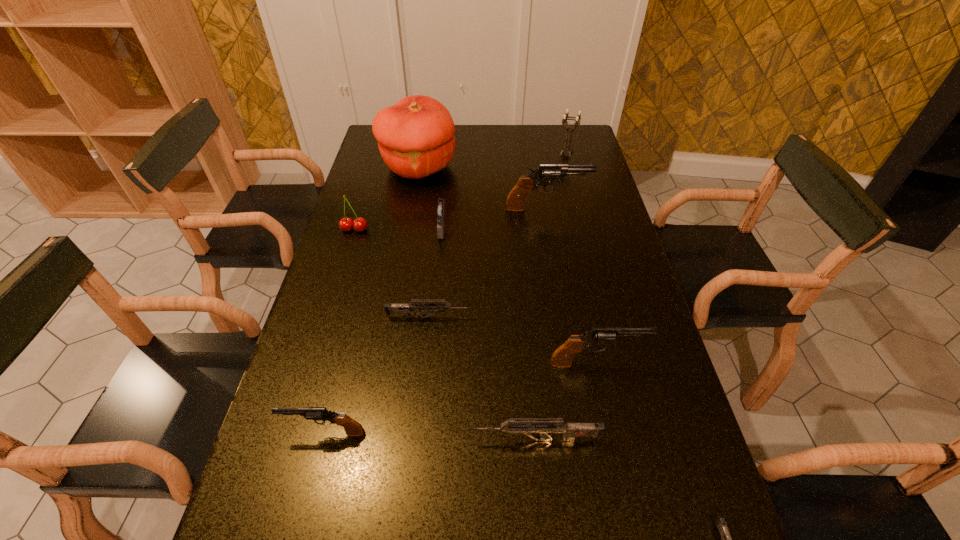
In order to click on free region located aimed along the barrel of the third shortest gun in this screenshot , I will do `click(275, 440)`.

Locate an element on the screen. The height and width of the screenshot is (540, 960). vacant space situated 0.240m aimed along the barrel of the third shortest gun is located at coordinates click(x=352, y=440).

The height and width of the screenshot is (540, 960). Identify the location of vacant space located 0.160m aimed along the barrel of the leftmost grey gun. (534, 317).

Find the location of a particular element. This screenshot has height=540, width=960. pumpkin located in the far edge section of the desktop is located at coordinates (415, 136).

This screenshot has height=540, width=960. I want to click on candle holder present at the far edge, so click(564, 121).

Locate an element on the screen. pumpkin at the left edge is located at coordinates (415, 136).

Locate an element on the screen. The width and height of the screenshot is (960, 540). cherry positioned at the left edge is located at coordinates (346, 224).

This screenshot has height=540, width=960. Identify the location of gun that is at the left edge. (352, 428).

Locate an element on the screen. Image resolution: width=960 pixels, height=540 pixels. candle holder located in the right edge section of the desktop is located at coordinates (564, 121).

Find the location of a particular element. object located at the far left corner is located at coordinates (415, 136).